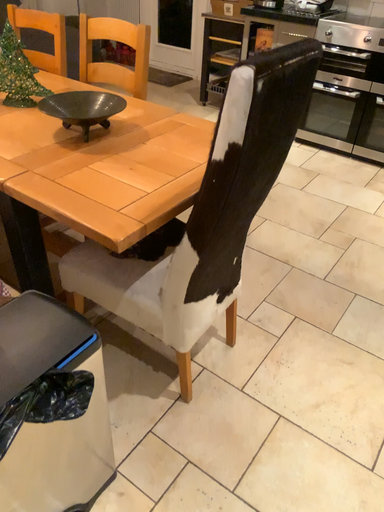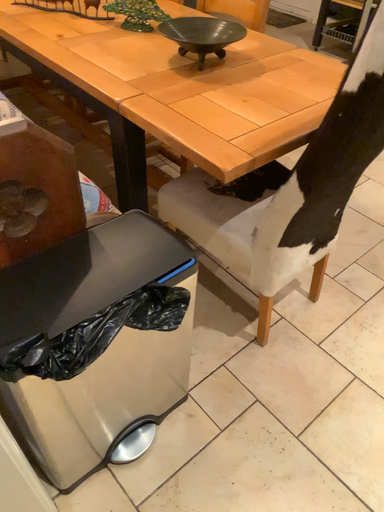
Question: Which way did the camera rotate in the video?

Choices:
 (A) rotated right
 (B) rotated left

Answer: (B)